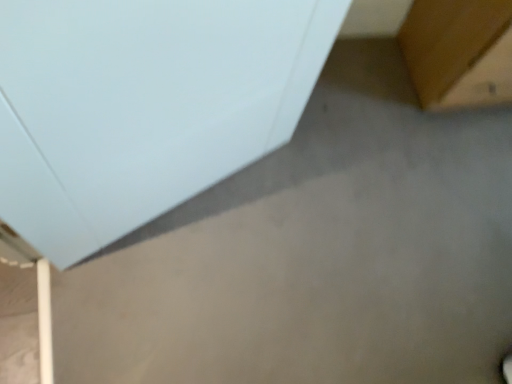
Question: Can you confirm if brown wood table at upper right, placed as the 2th furniture when sorted from left to right, is shorter than white matte cabinet at upper left, which is counted as the first furniture, starting from the left?

Choices:
 (A) yes
 (B) no

Answer: (A)

Question: Is brown wood table at upper right, placed as the 2th furniture when sorted from left to right, not close to white matte cabinet at upper left, which appears as the second furniture when viewed from the right?

Choices:
 (A) no
 (B) yes

Answer: (A)

Question: From a real-world perspective, is brown wood table at upper right, which appears as the first furniture when viewed from the right, beneath white matte cabinet at upper left, which appears as the second furniture when viewed from the right?

Choices:
 (A) no
 (B) yes

Answer: (B)

Question: Can we say brown wood table at upper right, placed as the 2th furniture when sorted from left to right, lies outside white matte cabinet at upper left, which appears as the second furniture when viewed from the right?

Choices:
 (A) no
 (B) yes

Answer: (B)

Question: From the image's perspective, would you say brown wood table at upper right, placed as the 2th furniture when sorted from left to right, is shown under white matte cabinet at upper left, which is counted as the first furniture, starting from the left?

Choices:
 (A) yes
 (B) no

Answer: (B)

Question: Can you confirm if brown wood table at upper right, placed as the 2th furniture when sorted from left to right, is smaller than white matte cabinet at upper left, which is counted as the first furniture, starting from the left?

Choices:
 (A) no
 (B) yes

Answer: (A)

Question: Does white matte cabinet at upper left, which appears as the second furniture when viewed from the right, have a lesser height compared to brown wood table at upper right, which appears as the first furniture when viewed from the right?

Choices:
 (A) yes
 (B) no

Answer: (B)

Question: Does white matte cabinet at upper left, which is counted as the first furniture, starting from the left, have a lesser width compared to brown wood table at upper right, which appears as the first furniture when viewed from the right?

Choices:
 (A) yes
 (B) no

Answer: (A)

Question: From a real-world perspective, is white matte cabinet at upper left, which is counted as the first furniture, starting from the left, on top of brown wood table at upper right, placed as the 2th furniture when sorted from left to right?

Choices:
 (A) yes
 (B) no

Answer: (A)

Question: Considering the relative sizes of white matte cabinet at upper left, which appears as the second furniture when viewed from the right, and brown wood table at upper right, which appears as the first furniture when viewed from the right, in the image provided, is white matte cabinet at upper left, which appears as the second furniture when viewed from the right, taller than brown wood table at upper right, which appears as the first furniture when viewed from the right,?

Choices:
 (A) no
 (B) yes

Answer: (B)

Question: From the image's perspective, is white matte cabinet at upper left, which appears as the second furniture when viewed from the right, under brown wood table at upper right, placed as the 2th furniture when sorted from left to right?

Choices:
 (A) yes
 (B) no

Answer: (A)

Question: Does white matte cabinet at upper left, which appears as the second furniture when viewed from the right, lie behind brown wood table at upper right, which appears as the first furniture when viewed from the right?

Choices:
 (A) no
 (B) yes

Answer: (A)

Question: Relative to white matte cabinet at upper left, which appears as the second furniture when viewed from the right, is brown wood table at upper right, placed as the 2th furniture when sorted from left to right, in front or behind?

Choices:
 (A) front
 (B) behind

Answer: (B)